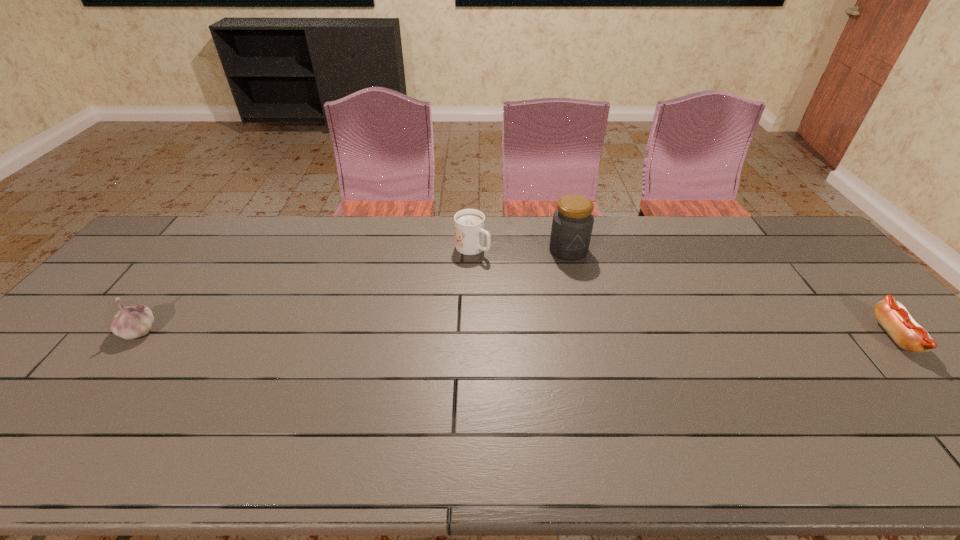
You are a GUI agent. You are given a task and a screenshot of the screen. Output one action in this format:
    pyautogui.click(x=<x>, y=<y>)
    Task: Click on the vacant point located between the rightmost object and the tallest object
    Image resolution: width=960 pixels, height=540 pixels.
    Given the screenshot: What is the action you would take?
    pyautogui.click(x=732, y=293)

In order to click on free point between the tallest object and the third object from right to left in this screenshot , I will do `click(520, 249)`.

Locate an element on the screen. vacant area that lies between the cappuccino and the garlic is located at coordinates (306, 289).

I want to click on free space between the rightmost object and the cappuccino, so click(684, 292).

Select which object is the second closest to the garlic. Please provide its 2D coordinates. Your answer should be formatted as a tuple, i.e. [(x, y)], where the tuple contains the x and y coordinates of a point satisfying the conditions above.

[(572, 224)]

Locate which object ranks third in proximity to the tallest object. Please provide its 2D coordinates. Your answer should be formatted as a tuple, i.e. [(x, y)], where the tuple contains the x and y coordinates of a point satisfying the conditions above.

[(136, 320)]

Where is `free region that satisfies the following two spatial constraints: 1. on the back side of the leftmost object; 2. on the right side of the cappuccino`? Image resolution: width=960 pixels, height=540 pixels. free region that satisfies the following two spatial constraints: 1. on the back side of the leftmost object; 2. on the right side of the cappuccino is located at coordinates (203, 248).

This screenshot has height=540, width=960. Identify the location of vacant space that satisfies the following two spatial constraints: 1. on the front side of the jar; 2. on the left side of the shortest object. (589, 336).

Locate an element on the screen. The width and height of the screenshot is (960, 540). free space that satisfies the following two spatial constraints: 1. on the front side of the second object from right to left; 2. on the left side of the cappuccino is located at coordinates (472, 250).

You are a GUI agent. You are given a task and a screenshot of the screen. Output one action in this format:
    pyautogui.click(x=<x>, y=<y>)
    Task: Click on the free space that satisfies the following two spatial constraints: 1. on the front side of the jar; 2. on the right side of the second object from left to right
    This screenshot has width=960, height=540.
    Given the screenshot: What is the action you would take?
    pyautogui.click(x=472, y=250)